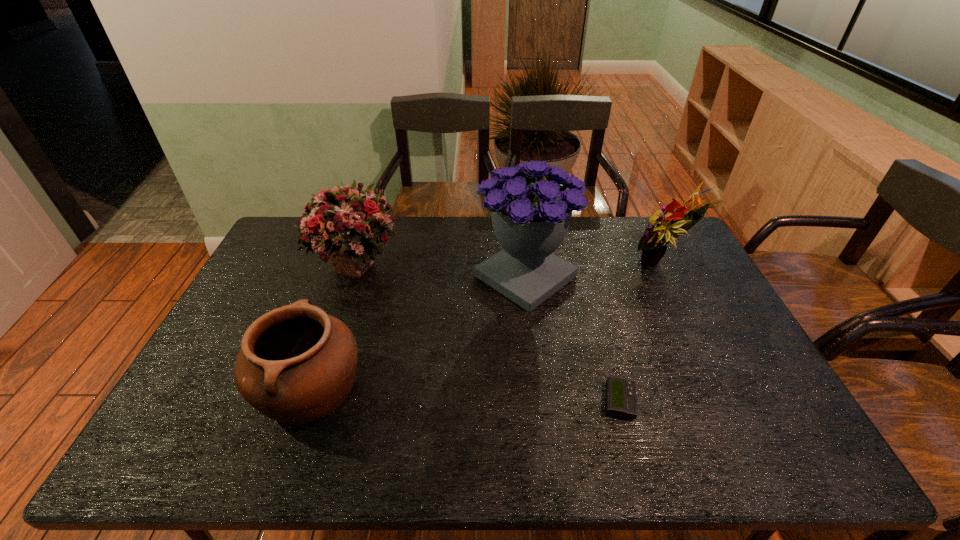
Identify which bouquet is the second closest to the rightmost object. Please provide its 2D coordinates. Your answer should be formatted as a tuple, i.e. [(x, y)], where the tuple contains the x and y coordinates of a point satisfying the conditions above.

[(345, 224)]

Identify the location of the second closest bouquet relative to the rightmost bouquet. The width and height of the screenshot is (960, 540). 345,224.

The width and height of the screenshot is (960, 540). In order to click on vacant area that satisfies the following two spatial constraints: 1. on the back side of the leftmost bouquet; 2. on the left side of the pottery in this screenshot , I will do tap(352, 264).

In order to click on free space that satisfies the following two spatial constraints: 1. on the front-facing side of the rightmost object; 2. on the front side of the shortest object in this screenshot , I will do `click(729, 402)`.